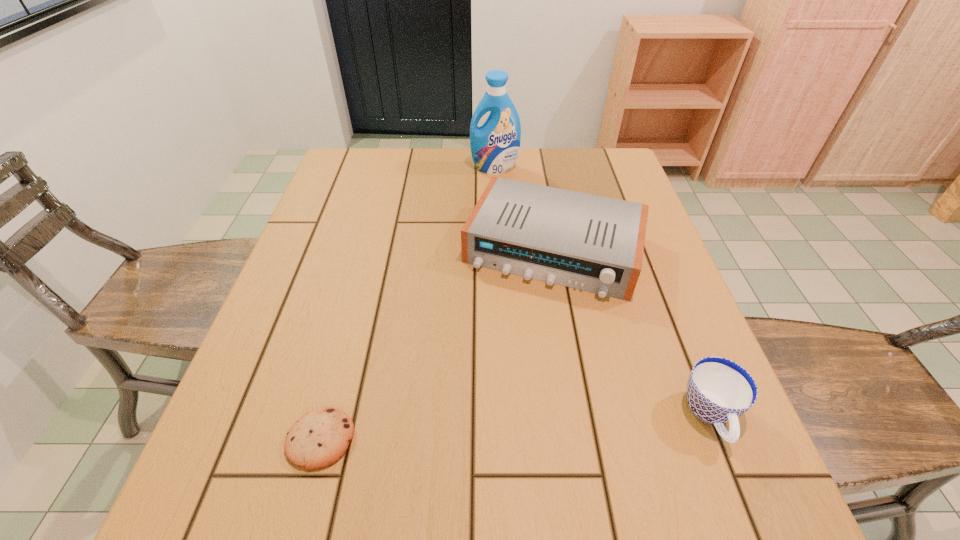
Find the location of `free space on the desktop that is between the shortest object and the cup and is positioned on the front-facing side of the detergent`. free space on the desktop that is between the shortest object and the cup and is positioned on the front-facing side of the detergent is located at coordinates (501, 428).

The width and height of the screenshot is (960, 540). What are the coordinates of `vacant space on the desktop that is between the leftmost object and the second shortest object and is positioned on the control panel of the second tallest object` in the screenshot? It's located at (492, 429).